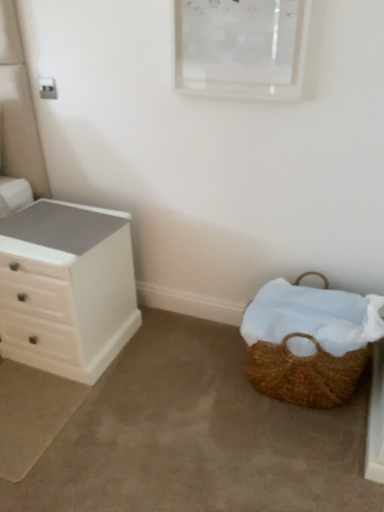
At what (x,y) coordinates should I click in order to perform the action: click on white matte chest of drawers at left. Please return your answer as a coordinate pair (x, y). This screenshot has width=384, height=512. Looking at the image, I should click on (66, 288).

Describe the element at coordinates (66, 288) in the screenshot. I see `white matte chest of drawers at left` at that location.

Where is `brown woven picnic basket at lower right`? The image size is (384, 512). brown woven picnic basket at lower right is located at coordinates (304, 343).

Image resolution: width=384 pixels, height=512 pixels. What do you see at coordinates (304, 343) in the screenshot? I see `brown woven picnic basket at lower right` at bounding box center [304, 343].

What is the approximate width of brown woven picnic basket at lower right?

The width of brown woven picnic basket at lower right is 17.35 inches.

Where is `white matte chest of drawers at left`? This screenshot has height=512, width=384. white matte chest of drawers at left is located at coordinates (66, 288).

Which is more to the left, white matte chest of drawers at left or brown woven picnic basket at lower right?

white matte chest of drawers at left is more to the left.

Which object is closer to the camera, white matte chest of drawers at left or brown woven picnic basket at lower right?

brown woven picnic basket at lower right is in front.

Considering the positions of point (70, 293) and point (322, 394), is point (70, 293) closer or farther from the camera than point (322, 394)?

Point (70, 293) is closer to the camera than point (322, 394).

From the image's perspective, is white matte chest of drawers at left on top of brown woven picnic basket at lower right?

Yes.

From a real-world perspective, which object rests below the other?

From a 3D spatial view, brown woven picnic basket at lower right is below.

Does white matte chest of drawers at left have a greater width compared to brown woven picnic basket at lower right?

Yes, white matte chest of drawers at left is wider than brown woven picnic basket at lower right.

Is white matte chest of drawers at left taller or shorter than brown woven picnic basket at lower right?

In the image, white matte chest of drawers at left appears to be taller than brown woven picnic basket at lower right.

Is white matte chest of drawers at left smaller than brown woven picnic basket at lower right?

Actually, white matte chest of drawers at left might be larger than brown woven picnic basket at lower right.

Does white matte chest of drawers at left contain brown woven picnic basket at lower right?

No, brown woven picnic basket at lower right is located outside of white matte chest of drawers at left.

Can you see white matte chest of drawers at left touching brown woven picnic basket at lower right?

No.

Is brown woven picnic basket at lower right at the back of white matte chest of drawers at left?

No, white matte chest of drawers at left is not facing the opposite direction of brown woven picnic basket at lower right.

How far apart are white matte chest of drawers at left and brown woven picnic basket at lower right?

white matte chest of drawers at left is 30.38 inches away from brown woven picnic basket at lower right.

Where is `chest of drawers above the brown woven picnic basket at lower right (from a real-world perspective)`? This screenshot has width=384, height=512. chest of drawers above the brown woven picnic basket at lower right (from a real-world perspective) is located at coordinates (66, 288).

Which is more to the right, brown woven picnic basket at lower right or white matte chest of drawers at left?

brown woven picnic basket at lower right is more to the right.

Is brown woven picnic basket at lower right in front of white matte chest of drawers at left?

Yes, the depth of brown woven picnic basket at lower right is less than that of white matte chest of drawers at left.

Between point (331, 403) and point (130, 287), which one is positioned behind?

The point (130, 287) is behind.

From the image's perspective, which one is positioned higher, brown woven picnic basket at lower right or white matte chest of drawers at left?

white matte chest of drawers at left, from the image's perspective.

From a real-world perspective, which is physically above, brown woven picnic basket at lower right or white matte chest of drawers at left?

white matte chest of drawers at left, from a real-world perspective.

Which of these two, brown woven picnic basket at lower right or white matte chest of drawers at left, is thinner?

brown woven picnic basket at lower right is thinner.

From the picture: Does brown woven picnic basket at lower right have a greater height compared to white matte chest of drawers at left?

No, brown woven picnic basket at lower right is not taller than white matte chest of drawers at left.

Does brown woven picnic basket at lower right have a smaller size compared to white matte chest of drawers at left?

Yes.

Is white matte chest of drawers at left located within brown woven picnic basket at lower right?

No, white matte chest of drawers at left is located outside of brown woven picnic basket at lower right.

Is brown woven picnic basket at lower right touching white matte chest of drawers at left?

No, brown woven picnic basket at lower right is not in contact with white matte chest of drawers at left.

Is brown woven picnic basket at lower right facing towards white matte chest of drawers at left?

No, brown woven picnic basket at lower right does not turn towards white matte chest of drawers at left.

How many degrees apart are the facing directions of brown woven picnic basket at lower right and white matte chest of drawers at left?

They differ by 1.73 degrees in their facing directions.

This screenshot has width=384, height=512. Find the location of `the chest of drawers lying behind the brown woven picnic basket at lower right`. the chest of drawers lying behind the brown woven picnic basket at lower right is located at coordinates (66, 288).

Identify the location of chest of drawers that appears on the left of brown woven picnic basket at lower right. This screenshot has width=384, height=512. (66, 288).

The height and width of the screenshot is (512, 384). Identify the location of the chest of drawers that appears behind the brown woven picnic basket at lower right. (66, 288).